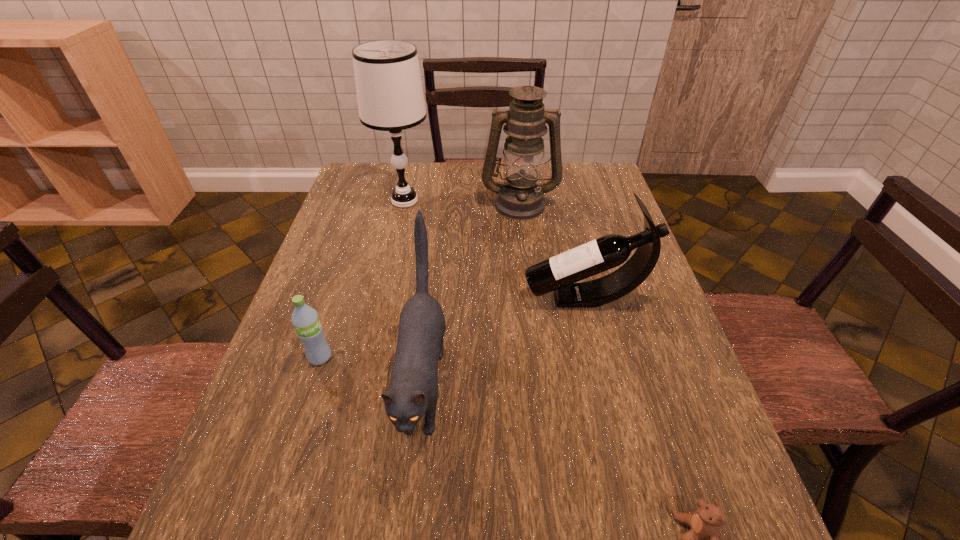
Image resolution: width=960 pixels, height=540 pixels. I want to click on table lamp, so click(x=390, y=96).

Where is `oil lamp`? oil lamp is located at coordinates point(520,198).

In order to click on cat in this screenshot , I will do (413, 392).

Find the location of `the fourth nearest object`. the fourth nearest object is located at coordinates 560,273.

Locate an element on the screen. the fifth tallest object is located at coordinates (309, 330).

The width and height of the screenshot is (960, 540). Identify the location of vacant space situated on the front of the table lamp. (382, 300).

Where is `free space located 0.090m on the right of the oil lamp`? free space located 0.090m on the right of the oil lamp is located at coordinates (587, 204).

I want to click on vacant space situated at the face of the cat, so click(411, 509).

Locate an element on the screen. blank area located on the stand of the fourth nearest object is located at coordinates (483, 298).

I want to click on vacant space located 0.130m on the stand of the fourth nearest object, so click(x=470, y=298).